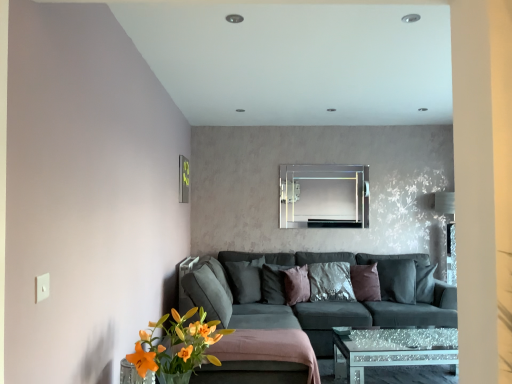
Describe the element at coordinates (246, 280) in the screenshot. I see `dark gray fabric pillow at center, arranged as the first pillow when viewed from the left` at that location.

In the scene shown: In order to face matte gray couch at center, should I rotate leftwards or rightwards?

To align with it, rotate right about 10.526°.

Where is `matte gray couch at center`? The image size is (512, 384). matte gray couch at center is located at coordinates (316, 299).

What do you see at coordinates (175, 345) in the screenshot?
I see `orange matte flower at lower left` at bounding box center [175, 345].

This screenshot has height=384, width=512. Identify the location of dark gray fabric pillow at center, arranged as the first pillow when viewed from the left. (246, 280).

How many degrees apart are the facing directions of orange matte flower at lower left and velvet purple pillow at center, marked as the 3th pillow in a left-to-right arrangement?

There is a 44.8-degree angle between the facing directions of orange matte flower at lower left and velvet purple pillow at center, marked as the 3th pillow in a left-to-right arrangement.

Image resolution: width=512 pixels, height=384 pixels. I want to click on the 1st pillow behind the orange matte flower at lower left, so click(x=296, y=285).

Does point (173, 342) appear closer or farther from the camera than point (301, 270)?

Clearly, point (173, 342) is closer to the camera than point (301, 270).

From a real-world perspective, is shiny metallic pillow at center, placed as the 4th pillow when sorted from left to right, physically above velvet purple pillow at center, the second pillow when ordered from right to left?

Indeed, from a real-world perspective, shiny metallic pillow at center, placed as the 4th pillow when sorted from left to right, stands above velvet purple pillow at center, the second pillow when ordered from right to left.

Considering their positions, is shiny metallic pillow at center, placed as the 4th pillow when sorted from left to right, located in front of or behind velvet purple pillow at center, the second pillow when ordered from right to left?

shiny metallic pillow at center, placed as the 4th pillow when sorted from left to right, is positioned farther from the viewer than velvet purple pillow at center, the second pillow when ordered from right to left.

Is shiny metallic pillow at center, placed as the 4th pillow when sorted from left to right, at the right side of velvet purple pillow at center, marked as the 3th pillow in a left-to-right arrangement?

Correct, you'll find shiny metallic pillow at center, placed as the 4th pillow when sorted from left to right, to the right of velvet purple pillow at center, marked as the 3th pillow in a left-to-right arrangement.

Is shiny metallic pillow at center, which appears as the first pillow when viewed from the right, with velvet purple pillow at center, the second pillow when ordered from right to left?

shiny metallic pillow at center, which appears as the first pillow when viewed from the right, is not next to velvet purple pillow at center, the second pillow when ordered from right to left, and they're not touching.

How different are the orientations of matte gray couch at center and dark gray fabric pillow at center, which appears as the fourth pillow when viewed from the right, in degrees?

matte gray couch at center and dark gray fabric pillow at center, which appears as the fourth pillow when viewed from the right, are facing 35.4 degrees away from each other.

Measure the distance from matte gray couch at center to dark gray fabric pillow at center, arranged as the first pillow when viewed from the left.

The distance of matte gray couch at center from dark gray fabric pillow at center, arranged as the first pillow when viewed from the left, is 58.46 centimeters.

Which of these two, matte gray couch at center or dark gray fabric pillow at center, arranged as the first pillow when viewed from the left, is bigger?

matte gray couch at center.

From a real-world perspective, is matte gray couch at center physically located above or below dark gray fabric pillow at center, arranged as the first pillow when viewed from the left?

Clearly, from a real-world perspective, matte gray couch at center is below dark gray fabric pillow at center, arranged as the first pillow when viewed from the left.

In the scene shown: Is shiny metallic pillow at center, which appears as the first pillow when viewed from the right, positioned before dark gray fabric pillow at center, arranged as the first pillow when viewed from the left?

No, shiny metallic pillow at center, which appears as the first pillow when viewed from the right, is further to the viewer.

Based on the photo, is shiny metallic pillow at center, placed as the 4th pillow when sorted from left to right, to the left or to the right of dark gray fabric pillow at center, which appears as the fourth pillow when viewed from the right, in the image?

From the image, it's evident that shiny metallic pillow at center, placed as the 4th pillow when sorted from left to right, is to the right of dark gray fabric pillow at center, which appears as the fourth pillow when viewed from the right.

Can you confirm if shiny metallic pillow at center, placed as the 4th pillow when sorted from left to right, is thinner than dark gray fabric pillow at center, arranged as the first pillow when viewed from the left?

Yes, shiny metallic pillow at center, placed as the 4th pillow when sorted from left to right, is thinner than dark gray fabric pillow at center, arranged as the first pillow when viewed from the left.

From a real-world perspective, is shiny metallic pillow at center, which appears as the first pillow when viewed from the right, above or below dark gray fabric pillow at center, arranged as the first pillow when viewed from the left?

In terms of real-world spatial position, shiny metallic pillow at center, which appears as the first pillow when viewed from the right, is below dark gray fabric pillow at center, arranged as the first pillow when viewed from the left.

Can you confirm if metallic rectangular frame at upper left is shorter than clear glass mirror at center?

Yes, metallic rectangular frame at upper left is shorter than clear glass mirror at center.

Where is `mirror below the metallic rectangular frame at upper left (from a real-world perspective)`? mirror below the metallic rectangular frame at upper left (from a real-world perspective) is located at coordinates pos(323,196).

Is point (185, 166) positioned in front of point (320, 200)?

Yes, point (185, 166) is in front of point (320, 200).

Is metallic rectangular frame at upper left oriented towards clear glass mirror at center?

Yes.

In the image, is clear glass mirror at center positioned in front of or behind matte gray couch at center?

Visually, clear glass mirror at center is located behind matte gray couch at center.

From a real-world perspective, is clear glass mirror at center below matte gray couch at center?

Actually, clear glass mirror at center is physically above matte gray couch at center in the real world.

Which of these two, clear glass mirror at center or matte gray couch at center, stands taller?

Standing taller between the two is matte gray couch at center.

From a real-world perspective, is metallic rectangular frame at upper left beneath dark gray fabric pillow at center, which appears as the fourth pillow when viewed from the right?

No, from a real-world perspective, metallic rectangular frame at upper left is not beneath dark gray fabric pillow at center, which appears as the fourth pillow when viewed from the right.

Considering the relative sizes of metallic rectangular frame at upper left and dark gray fabric pillow at center, which appears as the fourth pillow when viewed from the right, in the image provided, is metallic rectangular frame at upper left shorter than dark gray fabric pillow at center, which appears as the fourth pillow when viewed from the right,?

Incorrect, the height of metallic rectangular frame at upper left does not fall short of that of dark gray fabric pillow at center, which appears as the fourth pillow when viewed from the right.

Which of these two, metallic rectangular frame at upper left or dark gray fabric pillow at center, which appears as the fourth pillow when viewed from the right, is thinner?

metallic rectangular frame at upper left.

Do you think metallic rectangular frame at upper left is within dark gray fabric pillow at center, which appears as the fourth pillow when viewed from the right, or outside of it?

metallic rectangular frame at upper left is spatially situated outside dark gray fabric pillow at center, which appears as the fourth pillow when viewed from the right.

This screenshot has height=384, width=512. What are the coordinates of `the 4th pillow located beneath the orange matte flower at lower left (from a real-world perspective)` in the screenshot? It's located at (296, 285).

There is a velvet purple pillow at center, marked as the 3th pillow in a left-to-right arrangement. Where is `the 2nd pillow above it (from the image's perspective)`? the 2nd pillow above it (from the image's perspective) is located at coordinates (365, 282).

From the picture: Which object lies further to the anchor point velvet purple pillow at center, marked as the 3th pillow in a left-to-right arrangement, shiny metallic pillow at center, which appears as the first pillow when viewed from the right, or dark gray fabric pillow at center, which appears as the fourth pillow when viewed from the right?

Among the two, shiny metallic pillow at center, which appears as the first pillow when viewed from the right, is located further to velvet purple pillow at center, marked as the 3th pillow in a left-to-right arrangement.

From the image, which object appears to be farther from orange matte flower at lower left, purple velvet pillow at center, marked as the 3th pillow in a right-to-left arrangement, or matte gray couch at center?

purple velvet pillow at center, marked as the 3th pillow in a right-to-left arrangement, is further to orange matte flower at lower left.

Looking at the image, which one is located closer to metallic rectangular frame at upper left, velvet purple pillow at center, the second pillow when ordered from right to left, or orange matte flower at lower left?

The object closer to metallic rectangular frame at upper left is velvet purple pillow at center, the second pillow when ordered from right to left.

Based on their spatial positions, is velvet purple pillow at center, marked as the 3th pillow in a left-to-right arrangement, or dark gray fabric pillow at center, which appears as the fourth pillow when viewed from the right, further from shiny metallic pillow at center, placed as the 4th pillow when sorted from left to right?

Based on the image, dark gray fabric pillow at center, which appears as the fourth pillow when viewed from the right, appears to be further to shiny metallic pillow at center, placed as the 4th pillow when sorted from left to right.

Considering their positions, is velvet purple pillow at center, the second pillow when ordered from right to left, positioned further to shiny metallic pillow at center, which appears as the first pillow when viewed from the right, than metallic rectangular frame at upper left?

metallic rectangular frame at upper left.

Considering their positions, is metallic rectangular frame at upper left positioned closer to clear glass mirror at center than orange matte flower at lower left?

metallic rectangular frame at upper left is closer to clear glass mirror at center.

Considering their positions, is shiny metallic pillow at center, placed as the 4th pillow when sorted from left to right, positioned further to velvet purple pillow at center, the second pillow when ordered from right to left, than orange matte flower at lower left?

orange matte flower at lower left is further to velvet purple pillow at center, the second pillow when ordered from right to left.

Estimate the real-world distances between objects in this image. Which object is closer to clear glass mirror at center, orange matte flower at lower left or purple velvet pillow at center, acting as the 2th pillow starting from the left?

The object closer to clear glass mirror at center is purple velvet pillow at center, acting as the 2th pillow starting from the left.

Locate an element on the screen. The height and width of the screenshot is (384, 512). picture frame between orange matte flower at lower left and shiny metallic pillow at center, placed as the 4th pillow when sorted from left to right, in the front-back direction is located at coordinates (184, 179).

This screenshot has height=384, width=512. Identify the location of studio couch positioned between orange matte flower at lower left and metallic rectangular frame at upper left from near to far. (316, 299).

I want to click on pillow between orange matte flower at lower left and dark gray fabric pillow at center, arranged as the first pillow when viewed from the left, in the front-back direction, so coord(296,285).

I want to click on picture frame between orange matte flower at lower left and dark gray fabric pillow at center, which appears as the fourth pillow when viewed from the right, from front to back, so click(x=184, y=179).